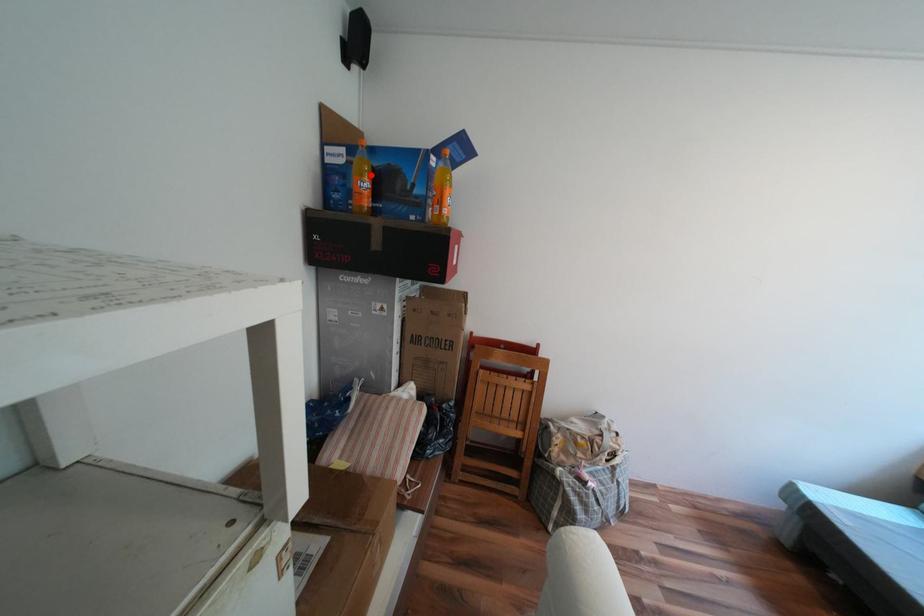
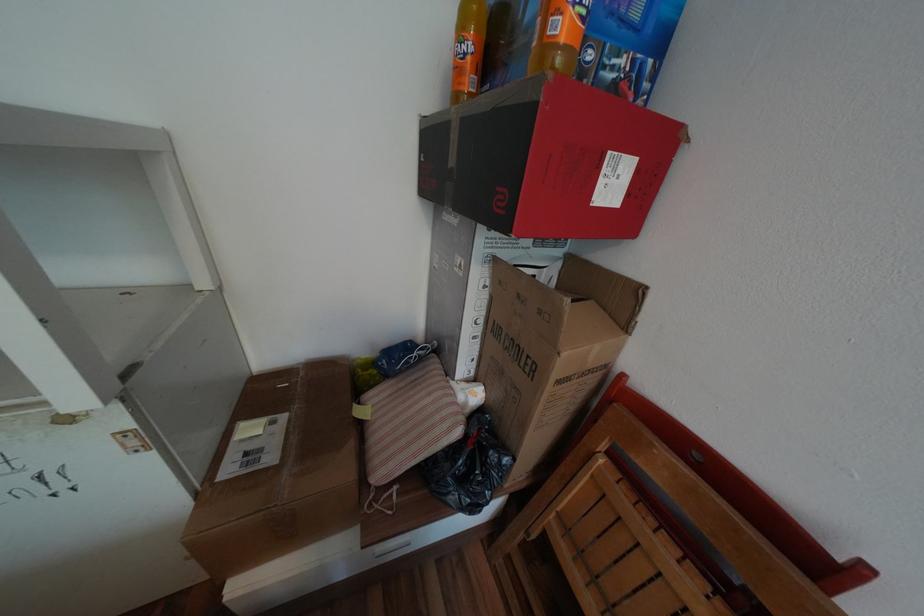
In the second image, find the point that corresponds to the highlighted location in the first image.

(472, 31)